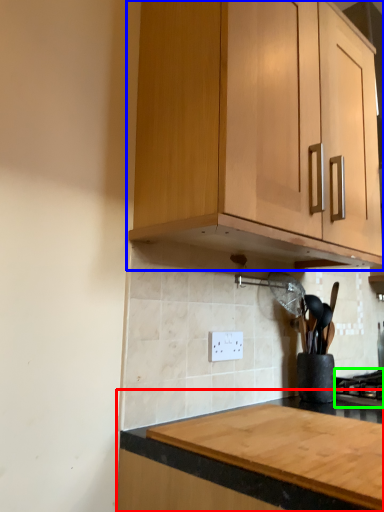
Question: Which object is positioned farthest from countertop (highlighted by a red box)? Select from cabinetry (highlighted by a blue box) and gas stove (highlighted by a green box).

Choices:
 (A) cabinetry
 (B) gas stove

Answer: (B)